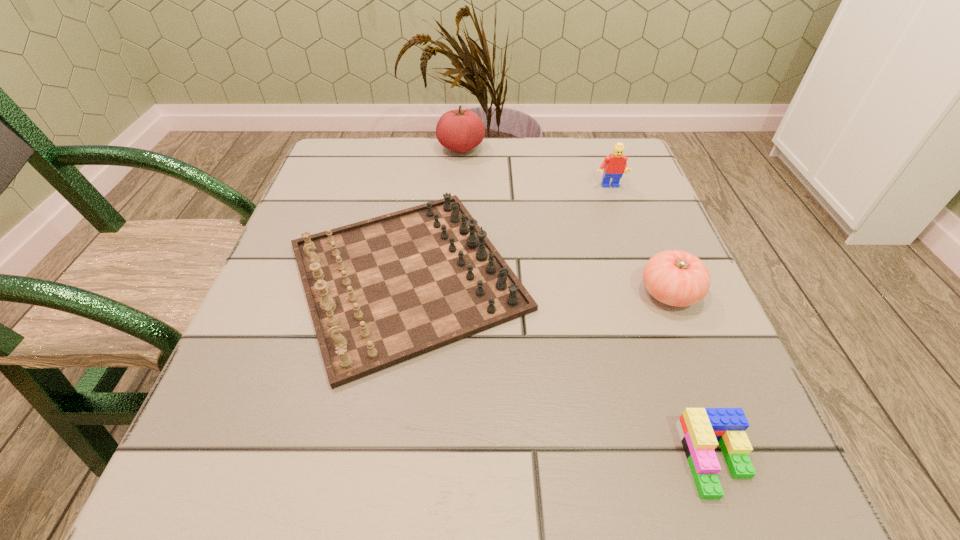
The image size is (960, 540). I want to click on the farther tomato, so click(460, 130).

At what (x,y) coordinates should I click in order to perform the action: click on the taller tomato. Please return your answer as a coordinate pair (x, y). This screenshot has width=960, height=540. Looking at the image, I should click on (460, 130).

The width and height of the screenshot is (960, 540). Identify the location of the farther Lego. (614, 165).

Where is `the fourth nearest object`? This screenshot has height=540, width=960. the fourth nearest object is located at coordinates 614,165.

Identify the location of chessboard. click(x=381, y=291).

Where is `the nearer tomato`? This screenshot has width=960, height=540. the nearer tomato is located at coordinates (677, 278).

I want to click on the shorter tomato, so click(x=677, y=278).

Image resolution: width=960 pixels, height=540 pixels. I want to click on the shorter Lego, so click(x=699, y=429).

Where is `the nearest object`? the nearest object is located at coordinates (699, 429).

Where is `free space located on the right of the left tomato`? free space located on the right of the left tomato is located at coordinates (561, 148).